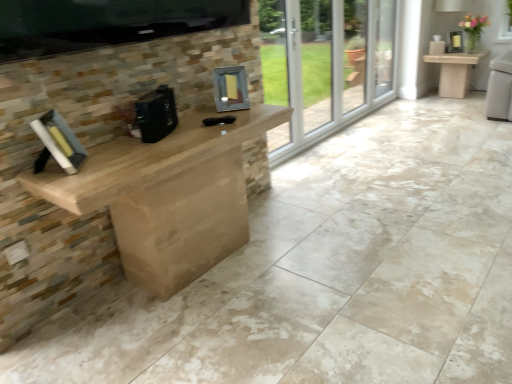
The width and height of the screenshot is (512, 384). Describe the element at coordinates (455, 72) in the screenshot. I see `matte stone table at right` at that location.

Locate an element on the screen. This screenshot has height=384, width=512. hardcover book at left is located at coordinates (58, 143).

From a real-world perspective, is hardcover book at left over matte stone table at right?

Yes, from a real-world perspective, hardcover book at left is on top of matte stone table at right.

Is matte stone table at right inside hardcover book at left?

No, hardcover book at left does not contain matte stone table at right.

Between point (38, 160) and point (484, 52), which one is positioned in front?

The point (38, 160) is closer.

Which object is positioned more to the right, hardcover book at left or matte stone table at right?

matte stone table at right.

Is hardcover book at left facing away from black matte coffee machine at center, which is the 1th appliance from left to right?

hardcover book at left is not turned away from black matte coffee machine at center, which is the 1th appliance from left to right.

In the image, is hardcover book at left positioned in front of or behind black matte coffee machine at center, positioned as the second appliance in back-to-front order?

In the image, hardcover book at left appears in front of black matte coffee machine at center, positioned as the second appliance in back-to-front order.

Is hardcover book at left at the left side of black matte coffee machine at center, positioned as the second appliance in back-to-front order?

Correct, you'll find hardcover book at left to the left of black matte coffee machine at center, positioned as the second appliance in back-to-front order.

From a real-world perspective, which is physically above, hardcover book at left or black matte coffee machine at center, positioned as the second appliance in back-to-front order?

hardcover book at left, from a real-world perspective.

Is metallic silver frame at center, acting as the 1th appliance starting from the right, with matte stone table at right?

No, metallic silver frame at center, acting as the 1th appliance starting from the right, is not with matte stone table at right.

Is metallic silver frame at center, which appears as the 1th appliance when viewed from the back, facing towards matte stone table at right?

No, metallic silver frame at center, which appears as the 1th appliance when viewed from the back, is not facing towards matte stone table at right.

Measure the distance from metallic silver frame at center, acting as the 1th appliance starting from the right, to matte stone table at right.

metallic silver frame at center, acting as the 1th appliance starting from the right, and matte stone table at right are 3.66 meters apart.

Where is `table behind the metallic silver frame at center, the 2th appliance in the front-to-back sequence`? The width and height of the screenshot is (512, 384). table behind the metallic silver frame at center, the 2th appliance in the front-to-back sequence is located at coordinates (455, 72).

From the picture: From the image's perspective, is black matte coffee machine at center, which is the 1th appliance from left to right, positioned above or below metallic silver frame at center, acting as the 1th appliance starting from the right?

black matte coffee machine at center, which is the 1th appliance from left to right, is below metallic silver frame at center, acting as the 1th appliance starting from the right.

Between black matte coffee machine at center, positioned as the second appliance in back-to-front order, and metallic silver frame at center, the 2th appliance in the front-to-back sequence, which one has smaller width?

With smaller width is black matte coffee machine at center, positioned as the second appliance in back-to-front order.

Choose the correct answer: Is black matte coffee machine at center, arranged as the second appliance when viewed from the right, inside metallic silver frame at center, the 2th appliance in the front-to-back sequence, or outside it?

black matte coffee machine at center, arranged as the second appliance when viewed from the right, exists outside the volume of metallic silver frame at center, the 2th appliance in the front-to-back sequence.

From the picture: Is black matte coffee machine at center, positioned as the first appliance in front-to-back order, with metallic silver frame at center, which is the second appliance in left-to-right order?

They are not placed beside each other.

Are metallic silver frame at center, which appears as the 1th appliance when viewed from the back, and black matte coffee machine at center, positioned as the first appliance in front-to-back order, beside each other?

No.

Considering the positions of objects metallic silver frame at center, the 2th appliance in the front-to-back sequence, and black matte coffee machine at center, arranged as the second appliance when viewed from the right, in the image provided, who is in front, metallic silver frame at center, the 2th appliance in the front-to-back sequence, or black matte coffee machine at center, arranged as the second appliance when viewed from the right,?

black matte coffee machine at center, arranged as the second appliance when viewed from the right, is in front.

Is metallic silver frame at center, which appears as the 1th appliance when viewed from the back, inside the boundaries of black matte coffee machine at center, positioned as the first appliance in front-to-back order, or outside?

metallic silver frame at center, which appears as the 1th appliance when viewed from the back, is located beyond the bounds of black matte coffee machine at center, positioned as the first appliance in front-to-back order.

Considering the relative positions of metallic silver frame at center, which appears as the 1th appliance when viewed from the back, and black matte coffee machine at center, arranged as the second appliance when viewed from the right, in the image provided, is metallic silver frame at center, which appears as the 1th appliance when viewed from the back, to the left of black matte coffee machine at center, arranged as the second appliance when viewed from the right, from the viewer's perspective?

No, metallic silver frame at center, which appears as the 1th appliance when viewed from the back, is not to the left of black matte coffee machine at center, arranged as the second appliance when viewed from the right.

Which of these two, metallic silver frame at center, which appears as the 1th appliance when viewed from the back, or hardcover book at left, is bigger?

hardcover book at left.

Is metallic silver frame at center, acting as the 1th appliance starting from the right, positioned with its back to hardcover book at left?

No, metallic silver frame at center, acting as the 1th appliance starting from the right, is not facing away from hardcover book at left.

From a real-world perspective, between metallic silver frame at center, acting as the 1th appliance starting from the right, and hardcover book at left, who is vertically lower?

hardcover book at left, from a real-world perspective.

Is metallic silver frame at center, acting as the 1th appliance starting from the right, placed right next to hardcover book at left?

metallic silver frame at center, acting as the 1th appliance starting from the right, and hardcover book at left are not in contact.

Is there a large distance between black matte coffee machine at center, positioned as the first appliance in front-to-back order, and hardcover book at left?

black matte coffee machine at center, positioned as the first appliance in front-to-back order, is actually quite close to hardcover book at left.

Between point (139, 124) and point (81, 151), which one is positioned behind?

Point (139, 124)

Which object is further away from the camera, black matte coffee machine at center, positioned as the first appliance in front-to-back order, or hardcover book at left?

black matte coffee machine at center, positioned as the first appliance in front-to-back order, is further from the camera.

Is black matte coffee machine at center, arranged as the second appliance when viewed from the right, looking in the opposite direction of hardcover book at left?

No, black matte coffee machine at center, arranged as the second appliance when viewed from the right, is not facing the opposite direction of hardcover book at left.

You are a GUI agent. You are given a task and a screenshot of the screen. Output one action in this format:
    pyautogui.click(x=<x>, y=<y>)
    Task: Click on the book below the matte stone table at right (from the image's perspective)
    The image size is (512, 384).
    Given the screenshot: What is the action you would take?
    pyautogui.click(x=58, y=143)

This screenshot has height=384, width=512. In order to click on appliance that is the 1st one when counting rightward from the hardcover book at left in this screenshot , I will do `click(156, 114)`.

When comparing their distances from matte stone table at right, does metallic silver frame at center, which appears as the 1th appliance when viewed from the back, or hardcover book at left seem closer?

metallic silver frame at center, which appears as the 1th appliance when viewed from the back.

Estimate the real-world distances between objects in this image. Which object is further from hardcover book at left, black matte coffee machine at center, which is the 1th appliance from left to right, or metallic silver frame at center, the 2th appliance in the front-to-back sequence?

metallic silver frame at center, the 2th appliance in the front-to-back sequence.

Which object lies nearer to the anchor point black matte coffee machine at center, arranged as the second appliance when viewed from the right, matte stone table at right or hardcover book at left?

Among the two, hardcover book at left is located nearer to black matte coffee machine at center, arranged as the second appliance when viewed from the right.

When comparing their distances from hardcover book at left, does metallic silver frame at center, which appears as the 1th appliance when viewed from the back, or black matte coffee machine at center, positioned as the first appliance in front-to-back order, seem closer?

The object closer to hardcover book at left is black matte coffee machine at center, positioned as the first appliance in front-to-back order.

From the image, which object appears to be nearer to matte stone table at right, metallic silver frame at center, acting as the 1th appliance starting from the right, or black matte coffee machine at center, arranged as the second appliance when viewed from the right?

metallic silver frame at center, acting as the 1th appliance starting from the right, lies closer to matte stone table at right than the other object.

When comparing their distances from black matte coffee machine at center, which is the 1th appliance from left to right, does metallic silver frame at center, the 2th appliance in the front-to-back sequence, or hardcover book at left seem further?

metallic silver frame at center, the 2th appliance in the front-to-back sequence, is further to black matte coffee machine at center, which is the 1th appliance from left to right.

From the picture: Based on their spatial positions, is hardcover book at left or matte stone table at right further from metallic silver frame at center, acting as the 1th appliance starting from the right?

Among the two, matte stone table at right is located further to metallic silver frame at center, acting as the 1th appliance starting from the right.

From the image, which object appears to be farther from metallic silver frame at center, which appears as the 1th appliance when viewed from the back, matte stone table at right or black matte coffee machine at center, positioned as the second appliance in back-to-front order?

matte stone table at right lies further to metallic silver frame at center, which appears as the 1th appliance when viewed from the back, than the other object.

Where is `appliance between hardcover book at left and metallic silver frame at center, which appears as the 1th appliance when viewed from the back, along the z-axis`? The width and height of the screenshot is (512, 384). appliance between hardcover book at left and metallic silver frame at center, which appears as the 1th appliance when viewed from the back, along the z-axis is located at coordinates (156, 114).

Where is `appliance between black matte coffee machine at center, arranged as the second appliance when viewed from the right, and matte stone table at right, in the horizontal direction`? Image resolution: width=512 pixels, height=384 pixels. appliance between black matte coffee machine at center, arranged as the second appliance when viewed from the right, and matte stone table at right, in the horizontal direction is located at coordinates (230, 89).